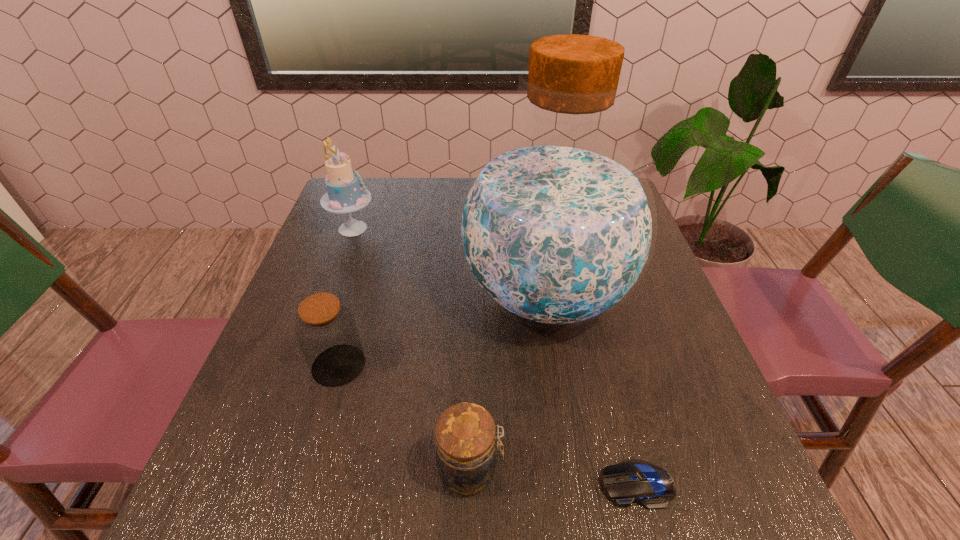
You are a GUI agent. You are given a task and a screenshot of the screen. Output one action in this format:
    pyautogui.click(x=<x>, y=<y>)
    Task: Click on the vacant space that's between the fourth shortest object and the shortest object
    This screenshot has height=540, width=960.
    Given the screenshot: What is the action you would take?
    pyautogui.click(x=495, y=356)

The width and height of the screenshot is (960, 540). In order to click on free spot between the tallest object and the left jar in this screenshot , I will do coord(442,330).

This screenshot has width=960, height=540. What are the coordinates of `free space between the third tallest object and the water jug` in the screenshot? It's located at (442, 330).

I want to click on free space that is in between the shortest object and the water jug, so click(x=591, y=390).

The height and width of the screenshot is (540, 960). In order to click on vacant area between the farthest object and the water jug in this screenshot , I will do `click(448, 262)`.

The image size is (960, 540). In order to click on free area in between the water jug and the shortest object in this screenshot , I will do `click(591, 390)`.

Locate an element on the screen. The height and width of the screenshot is (540, 960). unoccupied area between the fourth tallest object and the water jug is located at coordinates (508, 382).

Where is `free spot between the computer mouse and the fourth shortest object`? free spot between the computer mouse and the fourth shortest object is located at coordinates (495, 356).

Image resolution: width=960 pixels, height=540 pixels. What are the coordinates of `object that can be found as the fourth closest to the cake` in the screenshot? It's located at (631, 481).

Locate an element on the screen. The image size is (960, 540). the third closest object relative to the second shortest object is located at coordinates (326, 330).